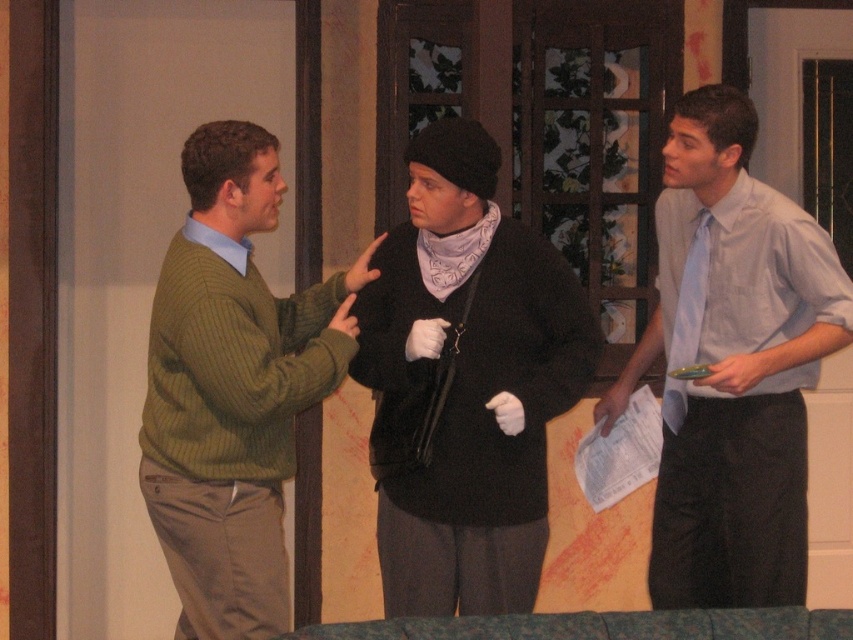
Can you confirm if black sweater at center is shorter than light blue shirt at right?

Correct, black sweater at center is not as tall as light blue shirt at right.

Does black sweater at center have a larger size compared to light blue shirt at right?

No.

Is point (457, 257) behind point (769, 296)?

That is False.

I want to click on black sweater at center, so click(x=465, y=384).

Is black sweater at center smaller than green ribbed sweater at left?

Indeed, black sweater at center has a smaller size compared to green ribbed sweater at left.

Is point (466, 145) positioned in front of point (347, 316)?

Yes, it is.

Is point (448, 522) farther from camera compared to point (215, 435)?

Yes, it is.

Identify the location of black sweater at center. This screenshot has width=853, height=640. (465, 384).

In the scene shown: How distant is light blue shirt at right from green ribbed sweater at left?

A distance of 3.61 feet exists between light blue shirt at right and green ribbed sweater at left.

I want to click on light blue shirt at right, so click(732, 364).

Image resolution: width=853 pixels, height=640 pixels. Find the location of `light blue shirt at right`. light blue shirt at right is located at coordinates (732, 364).

Locate an element on the screen. This screenshot has width=853, height=640. light blue shirt at right is located at coordinates pyautogui.click(x=732, y=364).